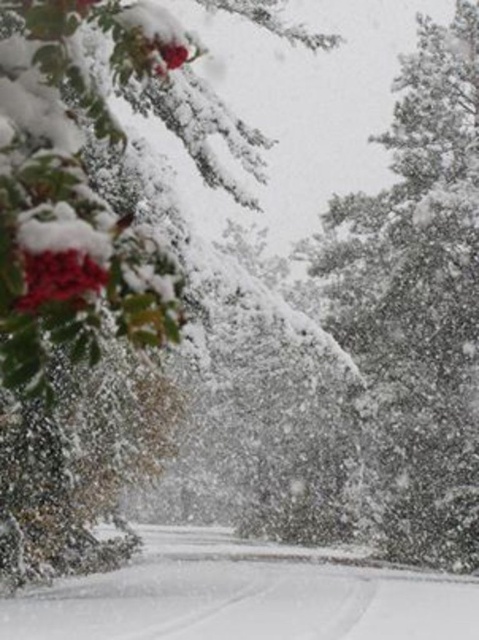
Question: Which object is farther from the camera taking this photo?

Choices:
 (A) white fluffy snow at upper right
 (B) white fluffy snow at center

Answer: (A)

Question: Which point appears farthest from the camera in this image?

Choices:
 (A) (476, 502)
 (B) (239, 566)

Answer: (A)

Question: Does white fluffy snow at upper right have a smaller size compared to white fluffy snow at center?

Choices:
 (A) yes
 (B) no

Answer: (B)

Question: Is white fluffy snow at upper right thinner than white fluffy snow at center?

Choices:
 (A) yes
 (B) no

Answer: (A)

Question: Observing the image, what is the correct spatial positioning of white fluffy snow at upper right in reference to white fluffy snow at center?

Choices:
 (A) left
 (B) right

Answer: (B)